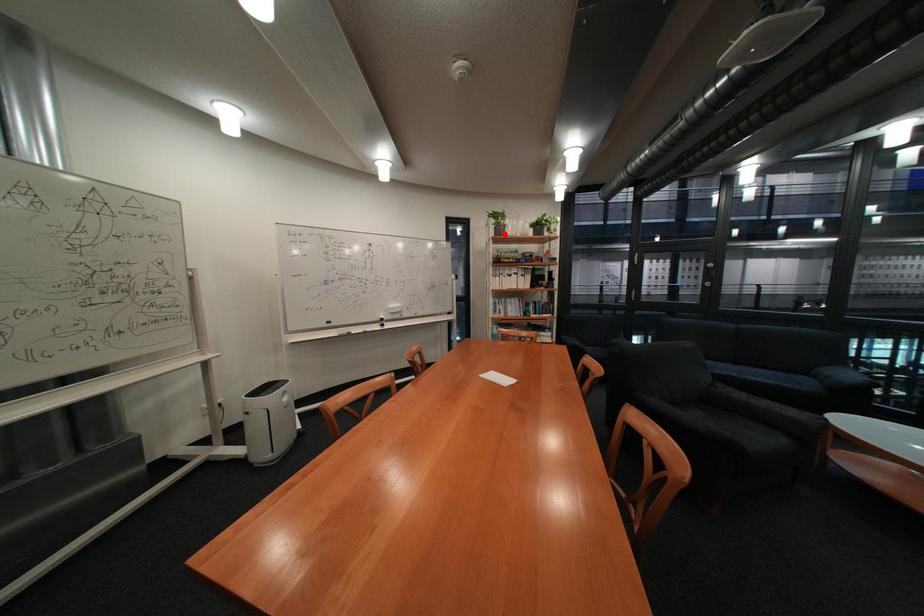
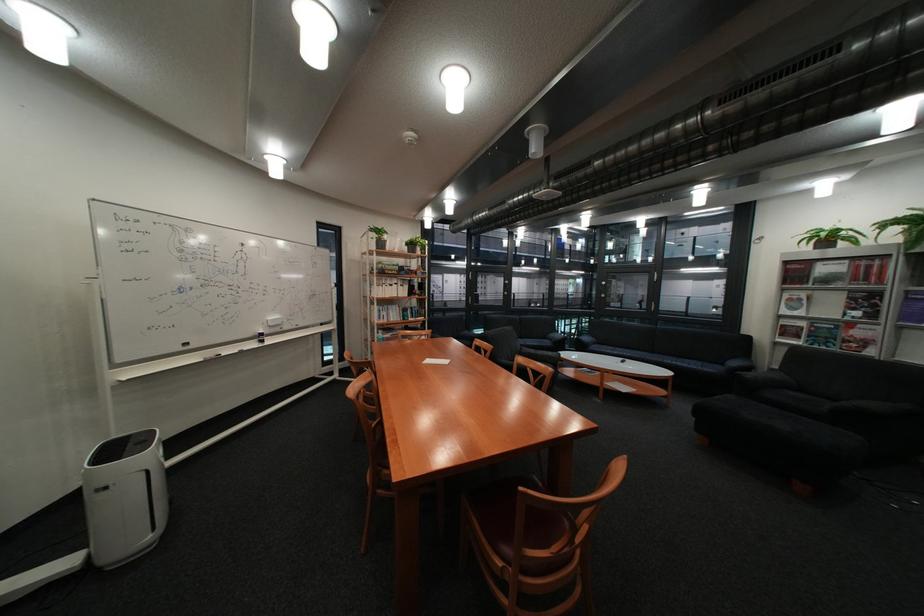
Locate, in the second image, the point that corresponds to the highlighted location in the first image.

(383, 246)